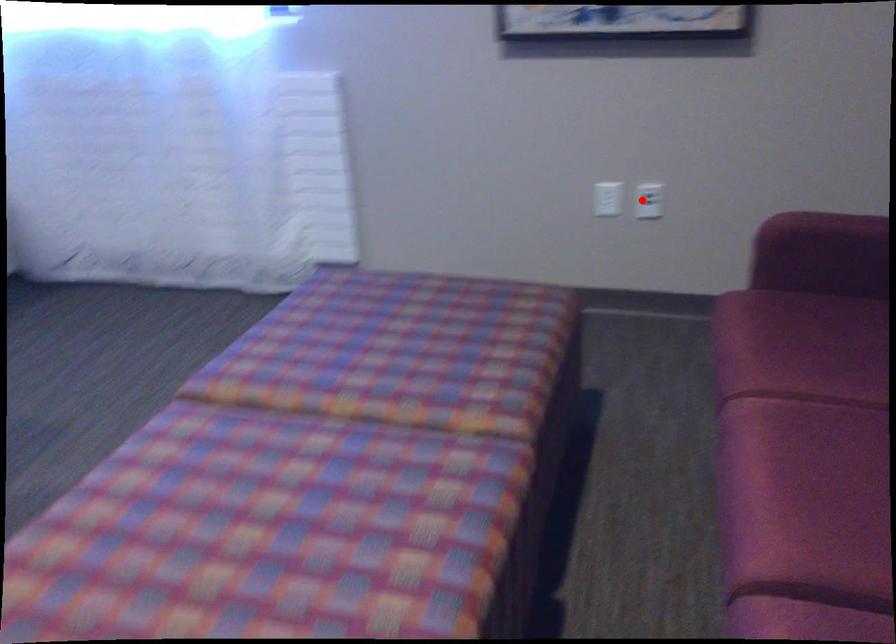
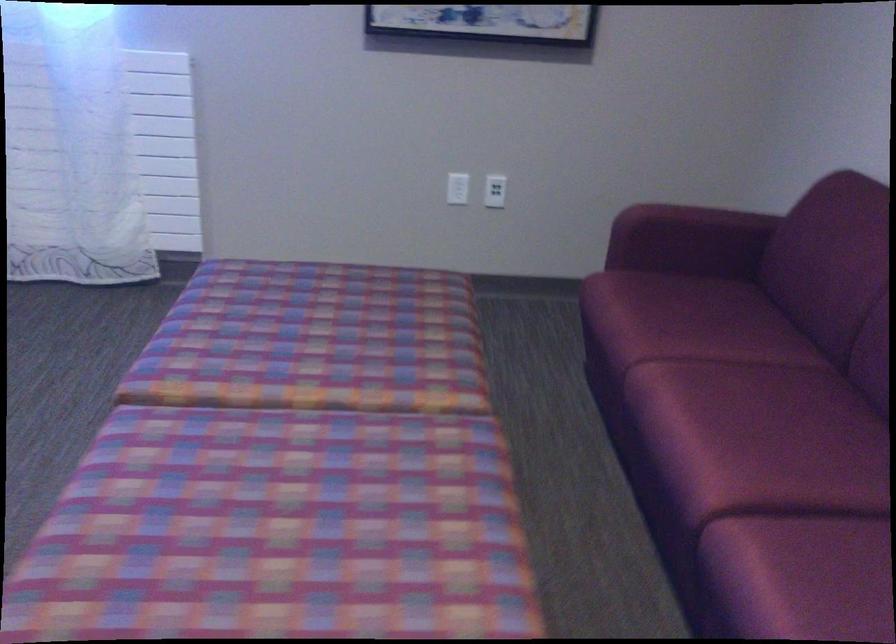
Where in the second image is the point corresponding to the highlighted location from the first image?

(495, 191)